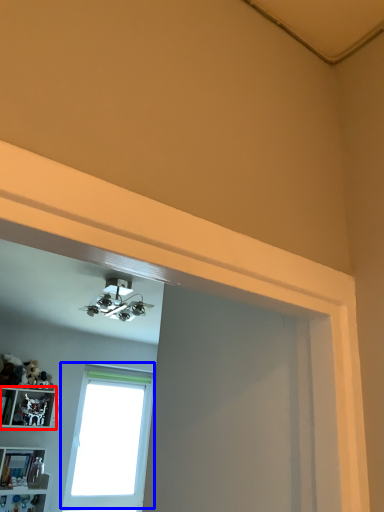
Question: Which object is closer to the camera taking this photo, shelf (highlighted by a red box) or window (highlighted by a blue box)?

Choices:
 (A) shelf
 (B) window

Answer: (A)